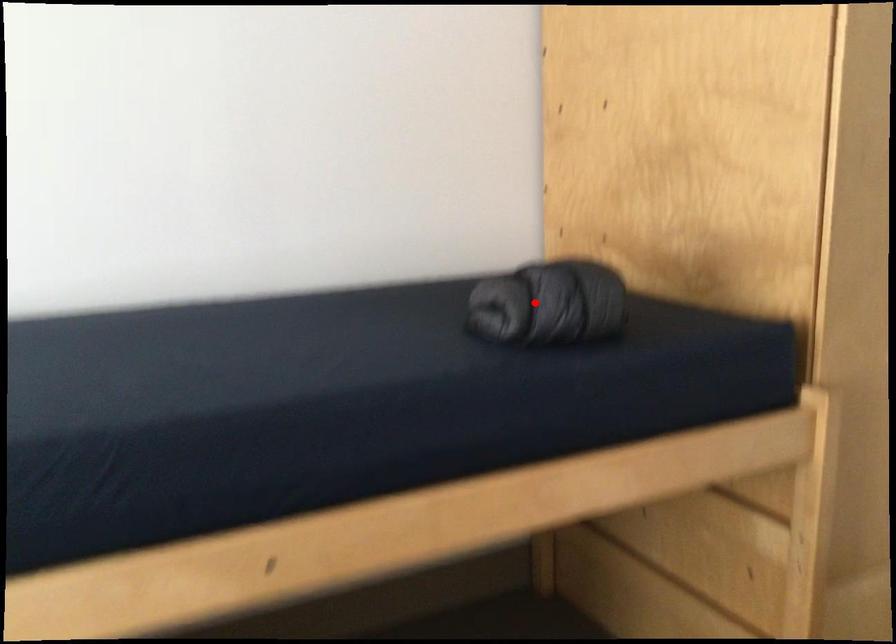
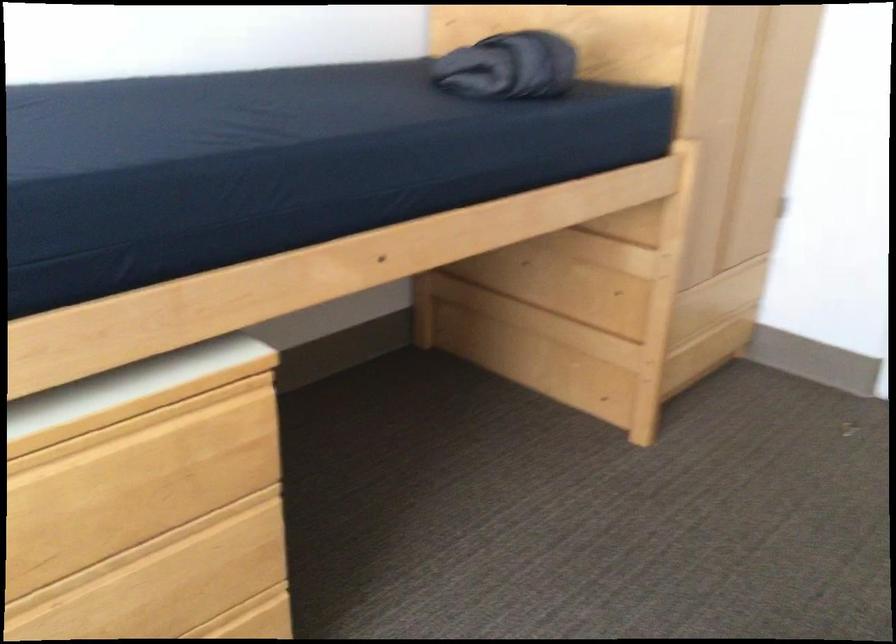
Locate, in the second image, the point that corresponds to the highlighted location in the first image.

(509, 67)